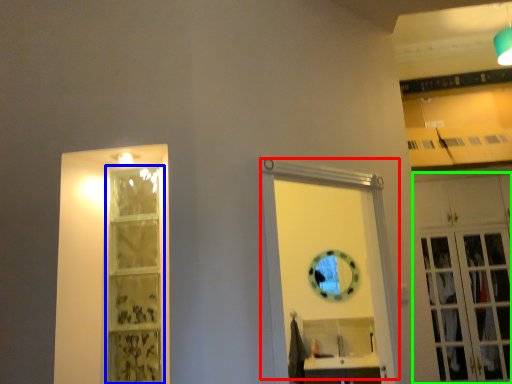
Question: Which is nearer to the door (highlighted by a red box)? shelf (highlighted by a blue box) or cabinetry (highlighted by a green box).

Choices:
 (A) shelf
 (B) cabinetry

Answer: (A)